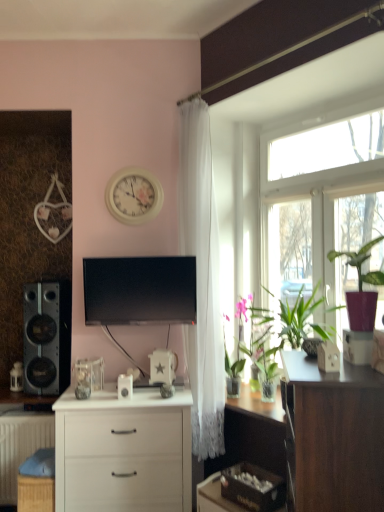
Locate an element on the screen. vacant space situated above woven brown picnic basket at lower left (from a real-world perspective) is located at coordinates (42, 456).